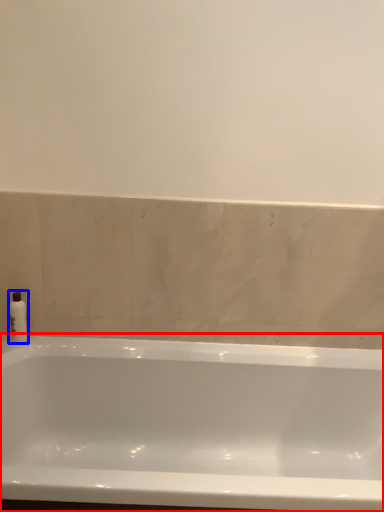
Question: Which object is further to the camera taking this photo, bathtub (highlighted by a red box) or soap dispenser (highlighted by a blue box)?

Choices:
 (A) bathtub
 (B) soap dispenser

Answer: (B)